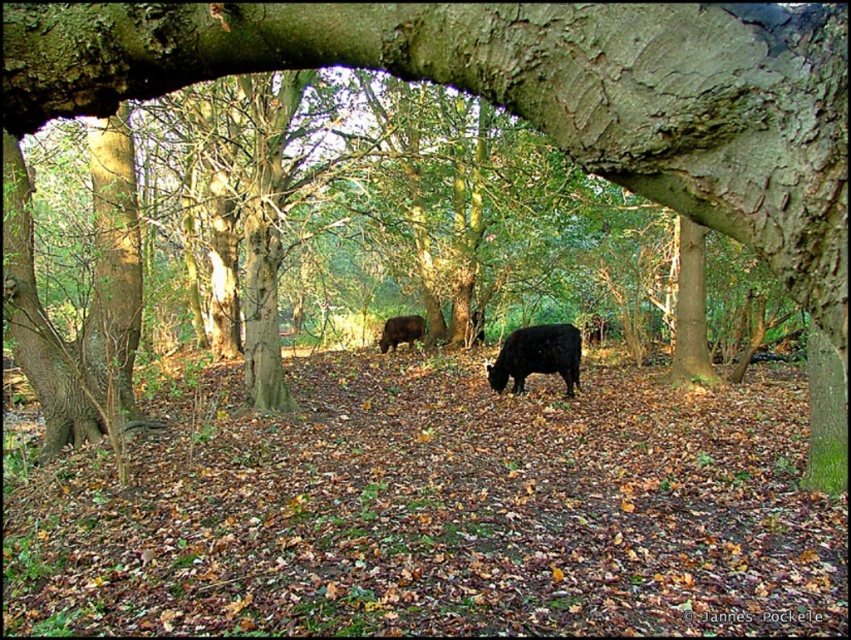
You are standing in the forest and want to place a small marker at each of the two points labeled point (569, 342) and point (412, 342). Which point is closer to you when you look through the archway?

Point (569, 342) is closer to the viewer than point (412, 342).

You are a farmer who wants to identify the bigger cow in the forest scene. You see a black glossy cow at center and a shiny brown cow at center. Which cow is larger?

The black glossy cow at center is larger than the shiny brown cow at center.

You are standing in the forest and see both the black glossy cow at center and the shiny brown cow at center. Which cow is wider?

The black glossy cow at center is wider than the shiny brown cow at center according to the description.